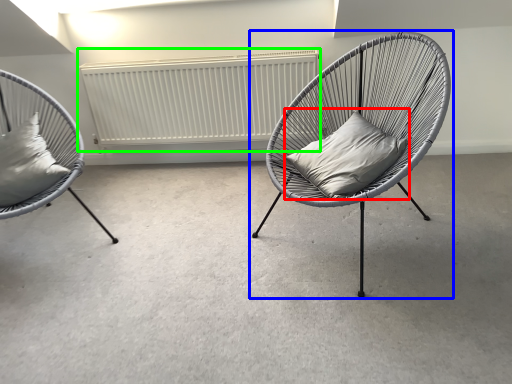
Question: Which object is positioned farthest from pillow (highlighted by a red box)? Select from chair (highlighted by a blue box) and radiator (highlighted by a green box).

Choices:
 (A) chair
 (B) radiator

Answer: (B)